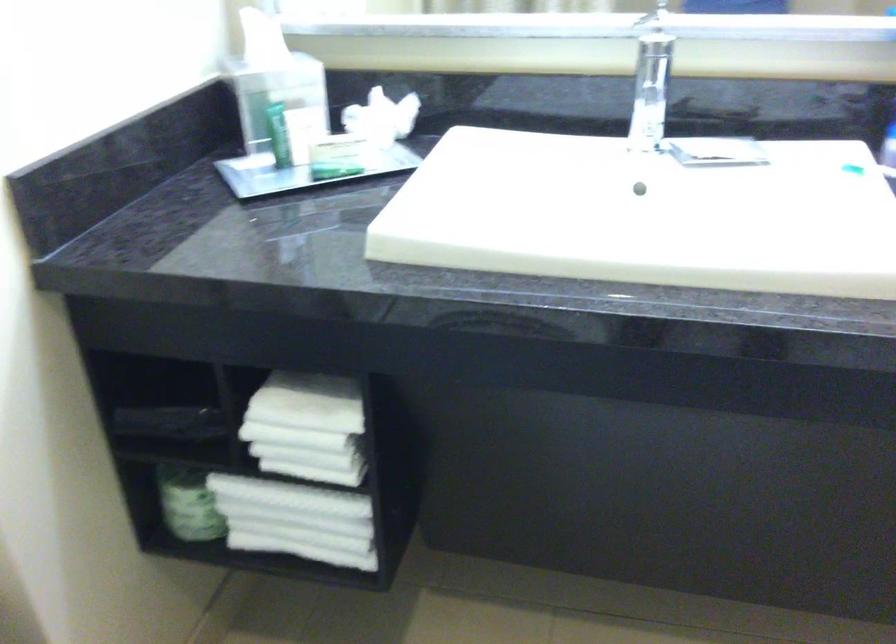
The height and width of the screenshot is (644, 896). What do you see at coordinates (382, 118) in the screenshot?
I see `the tissue from dispenser` at bounding box center [382, 118].